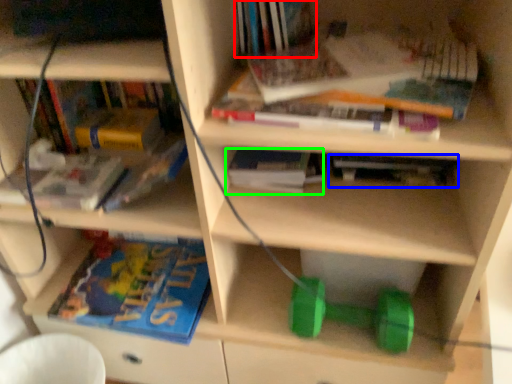
Question: Based on their relative distances, which object is farther from book (highlighted by a red box)? Choose from book (highlighted by a blue box) and book (highlighted by a green box).

Choices:
 (A) book
 (B) book

Answer: (A)